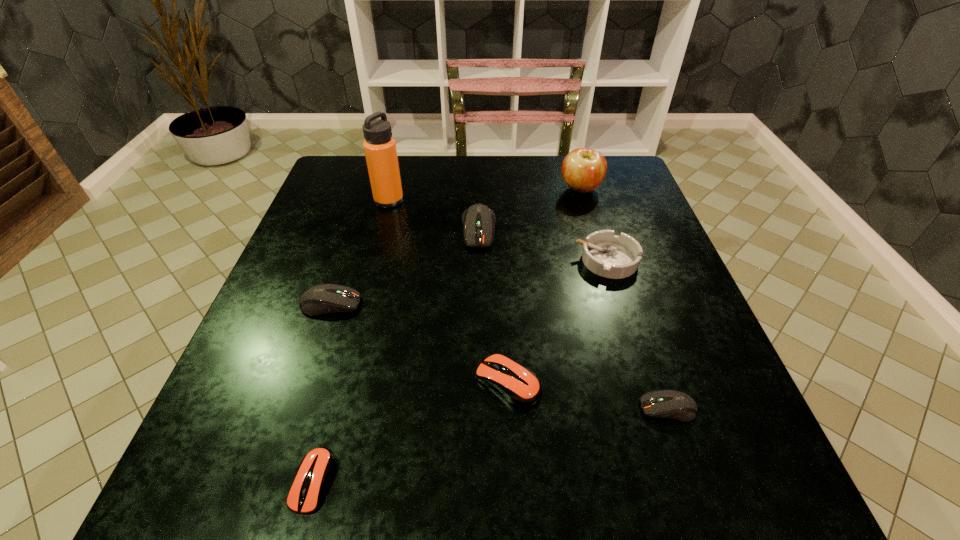
Find the location of a particular element. The width and height of the screenshot is (960, 540). the tallest object is located at coordinates (380, 149).

I want to click on thermos bottle, so click(380, 149).

This screenshot has width=960, height=540. Find the location of `apple`. apple is located at coordinates (583, 170).

At what (x,y) coordinates should I click in order to perform the action: click on the biggest dark computer equipment. Please return your answer as a coordinate pair (x, y). Looking at the image, I should click on (478, 220).

Where is `the farthest dark computer equipment`? Image resolution: width=960 pixels, height=540 pixels. the farthest dark computer equipment is located at coordinates (478, 220).

Identify the location of ashtray. The width and height of the screenshot is (960, 540). (611, 256).

The height and width of the screenshot is (540, 960). Identify the location of the second nearest dark computer equipment. (322, 299).

Identify the location of the fifth farthest object. (322, 299).

The height and width of the screenshot is (540, 960). Find the location of `the right orange computer mouse`. the right orange computer mouse is located at coordinates (515, 383).

This screenshot has height=540, width=960. Identify the location of the farther orange computer mouse. (515, 383).